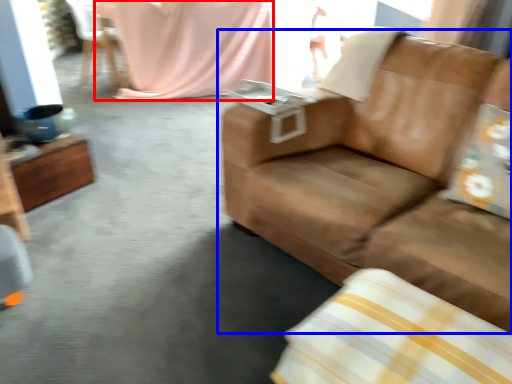
Question: Which object is further to the camera taking this photo, blanket (highlighted by a red box) or studio couch (highlighted by a blue box)?

Choices:
 (A) blanket
 (B) studio couch

Answer: (A)